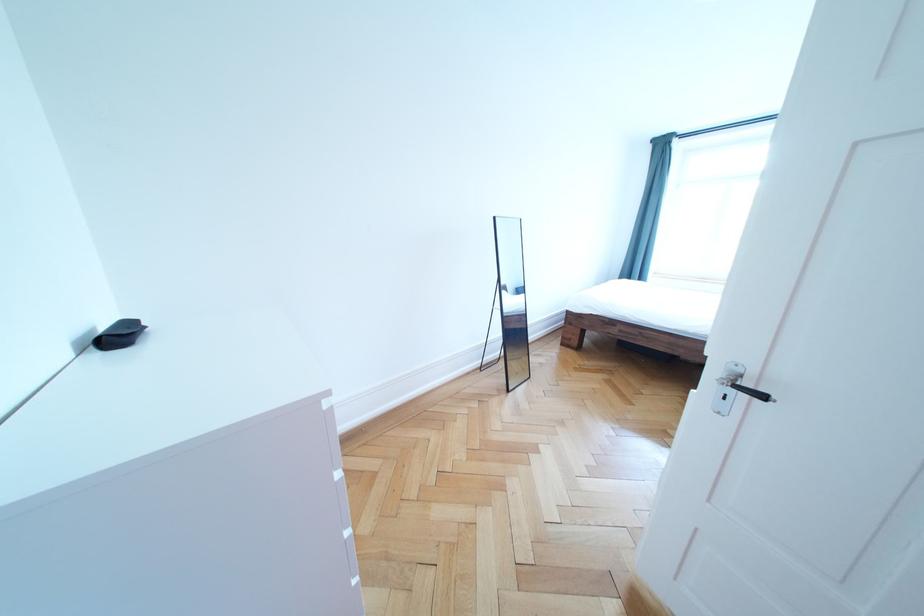
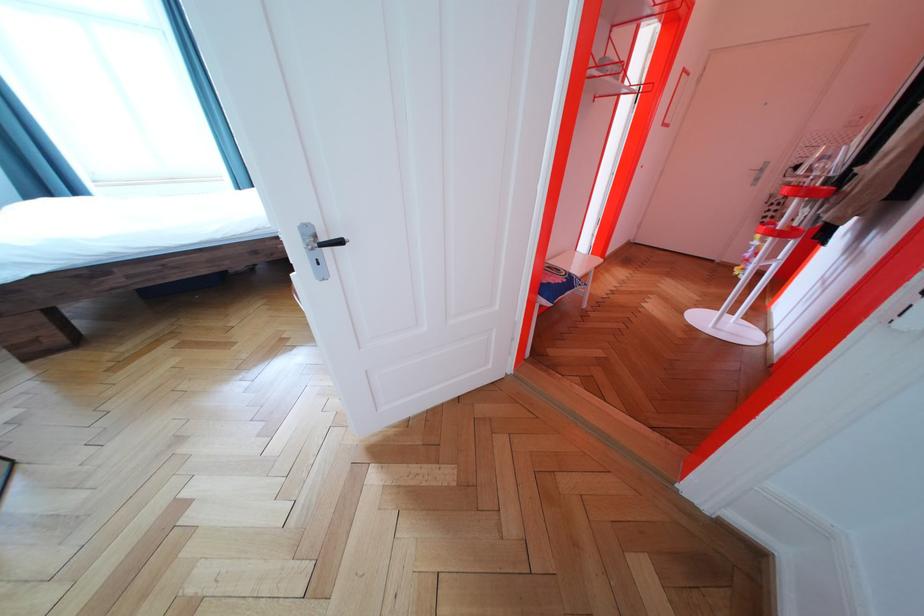
How did the camera likely rotate?

The camera rotated toward right-down.